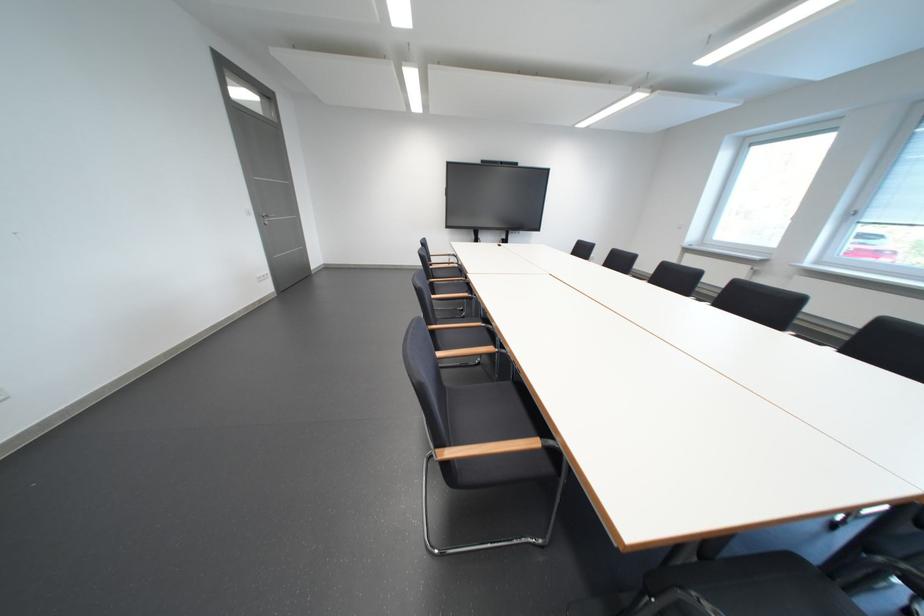
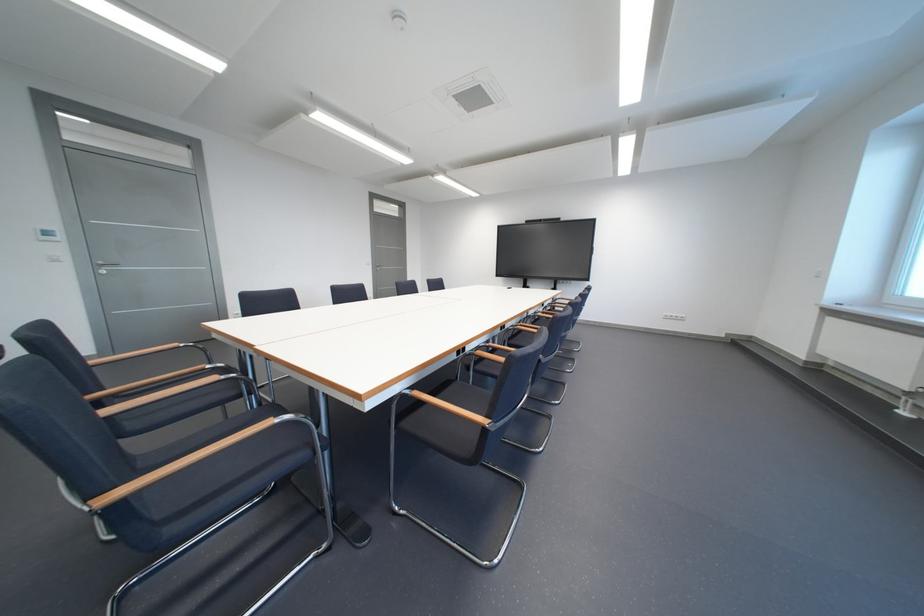
Question: I am providing you with two images of the same scene from different viewpoints. Please identify which objects are invisible in image2.

Choices:
 (A) purple bin handle
 (B) black chair sitting surface
 (C) wooden chair armrest
 (D) chair sitting surface

Answer: (B)